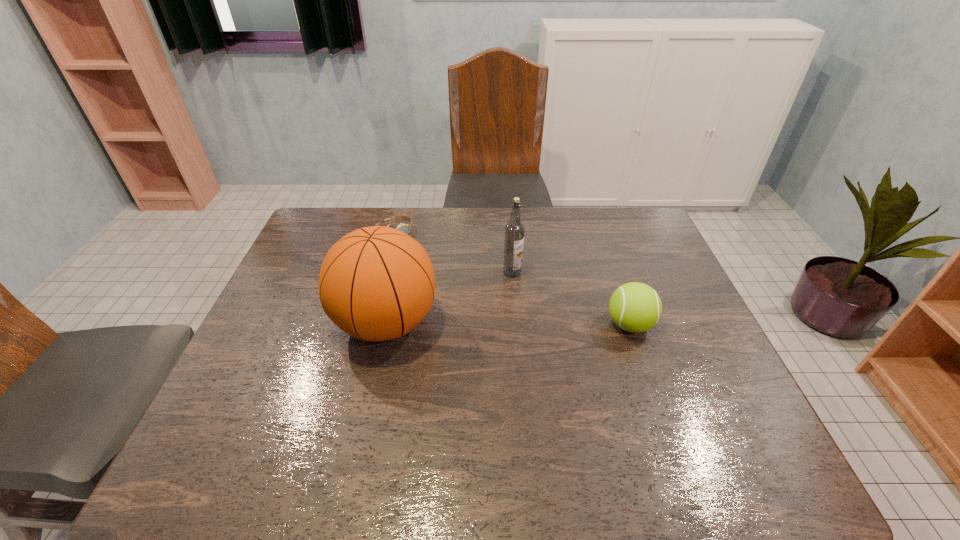
The height and width of the screenshot is (540, 960). I want to click on vacant space on the desktop that is between the basketball and the rightmost object and is positioned on the face of the watch, so click(494, 323).

Where is `vacant space on the desktop that is between the basketball and the third tallest object and is positioned on the label of the second farthest object`? The image size is (960, 540). vacant space on the desktop that is between the basketball and the third tallest object and is positioned on the label of the second farthest object is located at coordinates (533, 324).